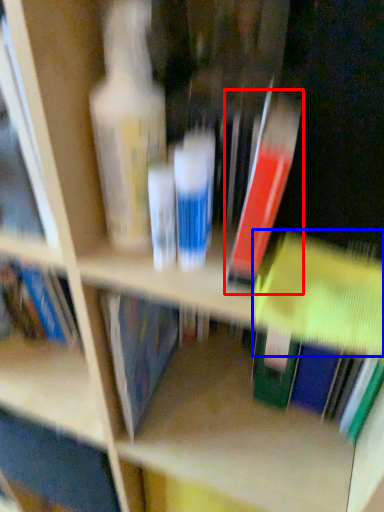
Question: Among these objects, which one is nearest to the camera, book (highlighted by a red box) or book (highlighted by a blue box)?

Choices:
 (A) book
 (B) book

Answer: (A)